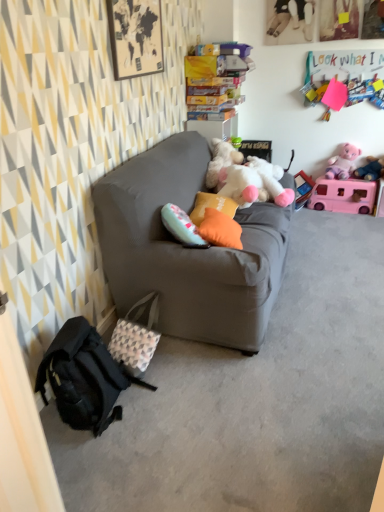
This screenshot has height=512, width=384. What are the coordinates of `pink plush toy at upper right, positioned as the 2th toy in top-to-bottom order` in the screenshot? It's located at (343, 162).

What do you see at coordinates (370, 169) in the screenshot?
I see `pink plush toy at upper right, the third toy in the bottom-to-top sequence` at bounding box center [370, 169].

Where is `patterned fabric bag at lower left`? patterned fabric bag at lower left is located at coordinates (136, 336).

Where is `black fabric backpack at lower left`? The width and height of the screenshot is (384, 512). black fabric backpack at lower left is located at coordinates (84, 377).

Measure the distance between pink plastic toy at upper right, the 2th toy ordered from the bottom, and camera.

pink plastic toy at upper right, the 2th toy ordered from the bottom, and camera are 12.40 feet apart.

Find the location of a particular element. The image size is (384, 512). pink plastic toy at upper right, the 2th toy ordered from the bottom is located at coordinates (343, 196).

I want to click on pink felt sign at upper right, the first toy in the top-to-bottom sequence, so click(x=343, y=73).

Would you say orange fabric pillow at center, the second pillow positioned from the back, is to the left or to the right of orange fabric pillow at center, arranged as the first pillow when viewed from the back, in the picture?

From the image, it's evident that orange fabric pillow at center, the second pillow positioned from the back, is to the right of orange fabric pillow at center, arranged as the first pillow when viewed from the back.

Is point (240, 248) closer or farther from the camera than point (219, 205)?

Point (240, 248) is positioned closer to the camera compared to point (219, 205).

From a real-world perspective, is orange fabric pillow at center, the second pillow positioned from the back, on top of orange fabric pillow at center, arranged as the first pillow when viewed from the back?

Yes, from a real-world perspective, orange fabric pillow at center, the second pillow positioned from the back, is above orange fabric pillow at center, arranged as the first pillow when viewed from the back.

Considering the sizes of objects orange fabric pillow at center, the second pillow positioned from the back, and orange fabric pillow at center, arranged as the first pillow when viewed from the back, in the image provided, who is taller, orange fabric pillow at center, the second pillow positioned from the back, or orange fabric pillow at center, arranged as the first pillow when viewed from the back,?

orange fabric pillow at center, the second pillow positioned from the back, is taller.

Which is behind, point (361, 53) or point (83, 409)?

The point (361, 53) is behind.

From a real-world perspective, which is physically below, pink felt sign at upper right, marked as the 5th toy in a bottom-to-top arrangement, or black fabric backpack at lower left?

black fabric backpack at lower left is physically lower.

Which is in front, pink felt sign at upper right, the first toy in the top-to-bottom sequence, or black fabric backpack at lower left?

black fabric backpack at lower left is closer to the camera.

Is there a large distance between pink felt sign at upper right, marked as the 5th toy in a bottom-to-top arrangement, and black fabric backpack at lower left?

Yes, pink felt sign at upper right, marked as the 5th toy in a bottom-to-top arrangement, and black fabric backpack at lower left are quite far apart.

Based on the photo, how many degrees apart are the facing directions of orange fabric pillow at center, arranged as the 1th pillow when viewed from the front, and patterned fabric bag at lower left?

They differ by 7.8 degrees in their facing directions.

Between orange fabric pillow at center, the second pillow positioned from the back, and patterned fabric bag at lower left, which one has less height?

orange fabric pillow at center, the second pillow positioned from the back.

Can patterned fabric bag at lower left be found inside orange fabric pillow at center, arranged as the 1th pillow when viewed from the front?

No, patterned fabric bag at lower left is located outside of orange fabric pillow at center, arranged as the 1th pillow when viewed from the front.

Can you confirm if orange fabric pillow at center, arranged as the 1th pillow when viewed from the front, is thinner than patterned fabric bag at lower left?

Indeed, orange fabric pillow at center, arranged as the 1th pillow when viewed from the front, has a lesser width compared to patterned fabric bag at lower left.

From a real-world perspective, is pink plush toy at upper right, marked as the third toy in a top-to-bottom arrangement, positioned over pink plastic toy at upper right, the fourth toy viewed from the top, based on gravity?

Correct, in the physical world, pink plush toy at upper right, marked as the third toy in a top-to-bottom arrangement, is higher than pink plastic toy at upper right, the fourth toy viewed from the top.

Does pink plush toy at upper right, the third toy in the bottom-to-top sequence, have a smaller size compared to pink plastic toy at upper right, the fourth toy viewed from the top?

Yes, pink plush toy at upper right, the third toy in the bottom-to-top sequence, is smaller than pink plastic toy at upper right, the fourth toy viewed from the top.

Is pink plush toy at upper right, the third toy in the bottom-to-top sequence, in front of pink plastic toy at upper right, the fourth toy viewed from the top?

Yes, the depth of pink plush toy at upper right, the third toy in the bottom-to-top sequence, is less than that of pink plastic toy at upper right, the fourth toy viewed from the top.

Could you measure the distance between pink plush toy at upper right, the third toy in the bottom-to-top sequence, and pink plastic toy at upper right, the 2th toy ordered from the bottom?

A distance of 8.21 inches exists between pink plush toy at upper right, the third toy in the bottom-to-top sequence, and pink plastic toy at upper right, the 2th toy ordered from the bottom.

From a real-world perspective, is patterned fabric bag at lower left located beneath matte gray couch at center?

Yes, from a real-world perspective, patterned fabric bag at lower left is beneath matte gray couch at center.

Is point (149, 308) closer or farther from the camera than point (153, 221)?

Point (149, 308) is positioned farther from the camera compared to point (153, 221).

Is matte gray couch at center surrounded by patterned fabric bag at lower left?

That's incorrect, matte gray couch at center is not inside patterned fabric bag at lower left.

Is patterned fabric bag at lower left aimed at matte gray couch at center?

No, patterned fabric bag at lower left is not facing towards matte gray couch at center.

Can you tell me how much patterned fabric bag at lower left and black fabric backpack at lower left differ in facing direction?

There is a 0.000196-degree angle between the facing directions of patterned fabric bag at lower left and black fabric backpack at lower left.

In the image, is patterned fabric bag at lower left positioned in front of or behind black fabric backpack at lower left?

patterned fabric bag at lower left is positioned farther from the viewer than black fabric backpack at lower left.

Is patterned fabric bag at lower left to the left or to the right of black fabric backpack at lower left in the image?

In the image, patterned fabric bag at lower left appears on the right side of black fabric backpack at lower left.

The width and height of the screenshot is (384, 512). There is a patterned fabric bag at lower left. Find the location of `backpack above it (from a real-world perspective)`. backpack above it (from a real-world perspective) is located at coordinates (84, 377).

From a real-world perspective, relative to patterned fabric bag at lower left, is orange fabric pillow at center, acting as the 2th pillow starting from the front, vertically above or below?

Clearly, from a real-world perspective, orange fabric pillow at center, acting as the 2th pillow starting from the front, is above patterned fabric bag at lower left.

Is orange fabric pillow at center, arranged as the first pillow when viewed from the back, in contact with patterned fabric bag at lower left?

No, orange fabric pillow at center, arranged as the first pillow when viewed from the back, is not touching patterned fabric bag at lower left.

Choose the correct answer: Is orange fabric pillow at center, acting as the 2th pillow starting from the front, inside patterned fabric bag at lower left or outside it?

The correct answer is: outside.

Considering the sizes of objects orange fabric pillow at center, acting as the 2th pillow starting from the front, and patterned fabric bag at lower left in the image provided, who is bigger, orange fabric pillow at center, acting as the 2th pillow starting from the front, or patterned fabric bag at lower left?

patterned fabric bag at lower left is bigger.

Locate an element on the screen. Image resolution: width=384 pixels, height=512 pixels. pillow that is below the orange fabric pillow at center, acting as the 2th pillow starting from the front (from the image's perspective) is located at coordinates (220, 229).

Locate an element on the screen. Image resolution: width=384 pixels, height=512 pixels. the 2nd toy behind the black fabric backpack at lower left, starting your count from the anchor is located at coordinates (343, 73).

Which object lies further to the anchor point white plush toy at center, marked as the 5th toy in a top-to-bottom arrangement, pink plastic toy at upper right, the 2th toy ordered from the bottom, or pink plush toy at upper right, positioned as the 2th toy in top-to-bottom order?

pink plush toy at upper right, positioned as the 2th toy in top-to-bottom order, is further to white plush toy at center, marked as the 5th toy in a top-to-bottom arrangement.

Looking at the image, which one is located further to matte gray couch at center, pink plastic toy at upper right, the fourth toy viewed from the top, or pink plush toy at upper right, which is counted as the 4th toy, starting from the bottom?

pink plush toy at upper right, which is counted as the 4th toy, starting from the bottom, lies further to matte gray couch at center than the other object.

Considering their positions, is pink plastic toy at upper right, the fourth toy viewed from the top, positioned further to matte gray couch at center than pink plush toy at upper right, the third toy in the bottom-to-top sequence?

Based on the image, pink plush toy at upper right, the third toy in the bottom-to-top sequence, appears to be further to matte gray couch at center.

When comparing their distances from matte gray couch at center, does pink plush toy at upper right, the third toy in the bottom-to-top sequence, or pink plastic toy at upper right, the fourth toy viewed from the top, seem closer?

Among the two, pink plastic toy at upper right, the fourth toy viewed from the top, is located nearer to matte gray couch at center.

Consider the image. Based on their spatial positions, is orange fabric pillow at center, the second pillow positioned from the back, or white plush toy at center, marked as the 5th toy in a top-to-bottom arrangement, closer to pink felt sign at upper right, the first toy in the top-to-bottom sequence?

Among the two, white plush toy at center, marked as the 5th toy in a top-to-bottom arrangement, is located nearer to pink felt sign at upper right, the first toy in the top-to-bottom sequence.

Based on their spatial positions, is orange fabric pillow at center, acting as the 2th pillow starting from the front, or patterned fabric bag at lower left closer to black fabric backpack at lower left?

patterned fabric bag at lower left lies closer to black fabric backpack at lower left than the other object.

Which object lies further to the anchor point pink plush toy at upper right, which is counted as the 4th toy, starting from the bottom, pink felt sign at upper right, the first toy in the top-to-bottom sequence, or matte gray couch at center?

matte gray couch at center.

Considering their positions, is black fabric backpack at lower left positioned further to orange fabric pillow at center, acting as the 2th pillow starting from the front, than pink felt sign at upper right, marked as the 5th toy in a bottom-to-top arrangement?

Among the two, pink felt sign at upper right, marked as the 5th toy in a bottom-to-top arrangement, is located further to orange fabric pillow at center, acting as the 2th pillow starting from the front.

The width and height of the screenshot is (384, 512). What are the coordinates of `bag between white plush toy at center, which appears as the first toy when ordered from the bottom, and black fabric backpack at lower left in the up-down direction` in the screenshot? It's located at (136, 336).

The image size is (384, 512). I want to click on pillow between black fabric backpack at lower left and orange fabric pillow at center, arranged as the first pillow when viewed from the back, in the front-back direction, so click(220, 229).

Find the location of `bag positioned between black fabric backpack at lower left and orange fabric pillow at center, acting as the 2th pillow starting from the front, from near to far`. bag positioned between black fabric backpack at lower left and orange fabric pillow at center, acting as the 2th pillow starting from the front, from near to far is located at coordinates 136,336.

You are a GUI agent. You are given a task and a screenshot of the screen. Output one action in this format:
    pyautogui.click(x=<x>, y=<y>)
    Task: Click on the bag between pink felt sign at upper right, the first toy in the top-to-bottom sequence, and black fabric backpack at lower left, in the vertical direction
    
    Given the screenshot: What is the action you would take?
    pyautogui.click(x=136, y=336)